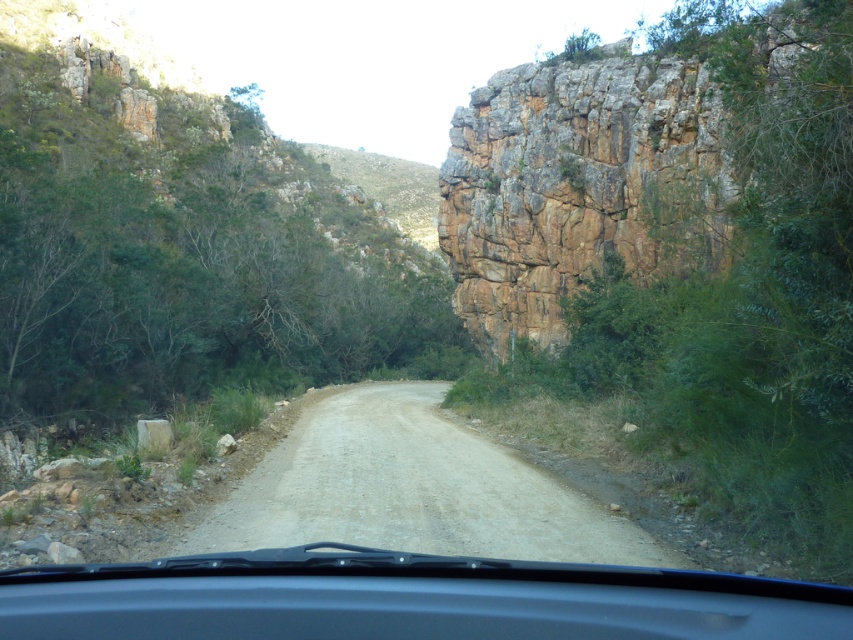
You are driving a car with a trunk that is 2 meters long. You need to safely pass through the narrow dirt road shown in the image. The brown rough rock face at right and transparent plastic windshield at center are obstacles. Can your car fit through the space between them?

The distance between the brown rough rock face at right and transparent plastic windshield at center is 22.15 meters, which is much larger than the 2 meter length of your car trunk. Therefore, your car can safely pass through the space between them.

You are driving a car with a 1.8 meter wide trailer attached. You see the transparent plastic windshield at center and the dusty gravel road at center. Can your vehicle and trailer safely navigate the road without hitting the rocks on the right side?

The transparent plastic windshield at center is to the right of the dusty gravel road at center, which indicates the road curves to the right. Since the trailer is 1.8 meters wide, you need to ensure the road is wide enough to accommodate the turn. However, the description mentions the road is narrow and the rocks on the right are large and jagged. Without specific width details, it is risky. Proceed with caution, staying as close to the left as possible to avoid collision.